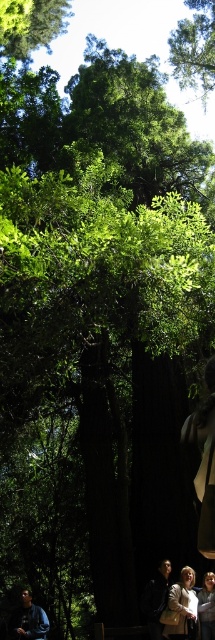
Question: Estimate the real-world distances between objects in this image. Which object is closer to the white fabric jacket at lower center?

Choices:
 (A) light brown leather jacket at lower right
 (B) blue denim jacket at lower left

Answer: (A)

Question: Is white fabric jacket at lower center above light brown leather jacket at lower right?

Choices:
 (A) no
 (B) yes

Answer: (A)

Question: Estimate the real-world distances between objects in this image. Which object is closer to the white fabric jacket at lower center?

Choices:
 (A) blue denim jacket at lower left
 (B) light brown leather jacket at lower right

Answer: (B)

Question: Estimate the real-world distances between objects in this image. Which object is farther from the blue denim jacket at lower left?

Choices:
 (A) light brown leather jacket at lower right
 (B) white fabric jacket at lower center

Answer: (A)

Question: Can you confirm if white fabric jacket at lower center is positioned to the left of light brown leather jacket at lower right?

Choices:
 (A) no
 (B) yes

Answer: (B)

Question: Is white fabric jacket at lower center wider than light brown leather jacket at lower right?

Choices:
 (A) yes
 (B) no

Answer: (A)